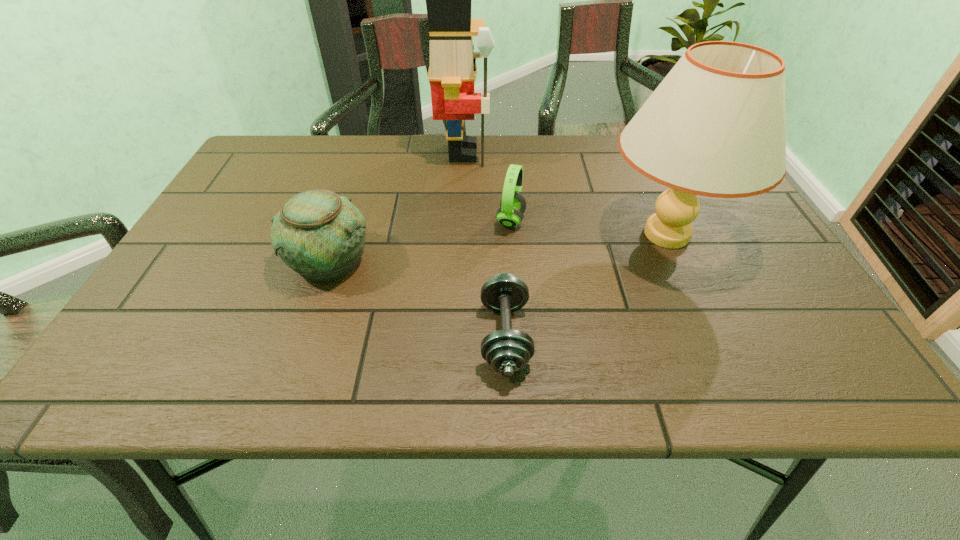
What are the coordinates of `vacant area that lies between the pottery and the headset` in the screenshot? It's located at (420, 240).

Identify the location of empty space that is in between the pottery and the nutcracker. The image size is (960, 540). (396, 206).

Where is `free space between the dumbbell and the rightmost object`? The height and width of the screenshot is (540, 960). free space between the dumbbell and the rightmost object is located at coordinates (586, 285).

At what (x,y) coordinates should I click in order to perform the action: click on unoccupied position between the dumbbell and the leftmost object. Please return your answer as a coordinate pair (x, y). This screenshot has width=960, height=540. Looking at the image, I should click on (417, 298).

Image resolution: width=960 pixels, height=540 pixels. I want to click on vacant region between the farthest object and the headset, so click(x=487, y=186).

This screenshot has width=960, height=540. In order to click on empty space between the shortest object and the leftmost object in this screenshot , I will do (417, 298).

Where is `free space between the shortest object and the rightmost object`? The height and width of the screenshot is (540, 960). free space between the shortest object and the rightmost object is located at coordinates (586, 285).

Identify which object is located as the second nearest to the pottery. Please provide its 2D coordinates. Your answer should be formatted as a tuple, i.e. [(x, y)], where the tuple contains the x and y coordinates of a point satisfying the conditions above.

[(512, 206)]

This screenshot has height=540, width=960. Identify the location of object that is the second closest one to the headset. (715, 126).

This screenshot has height=540, width=960. Find the location of `vacant region that satisfies the following two spatial constraints: 1. in front of the rightmost object holding the staff; 2. on the left side of the nutcracker`. vacant region that satisfies the following two spatial constraints: 1. in front of the rightmost object holding the staff; 2. on the left side of the nutcracker is located at coordinates (459, 234).